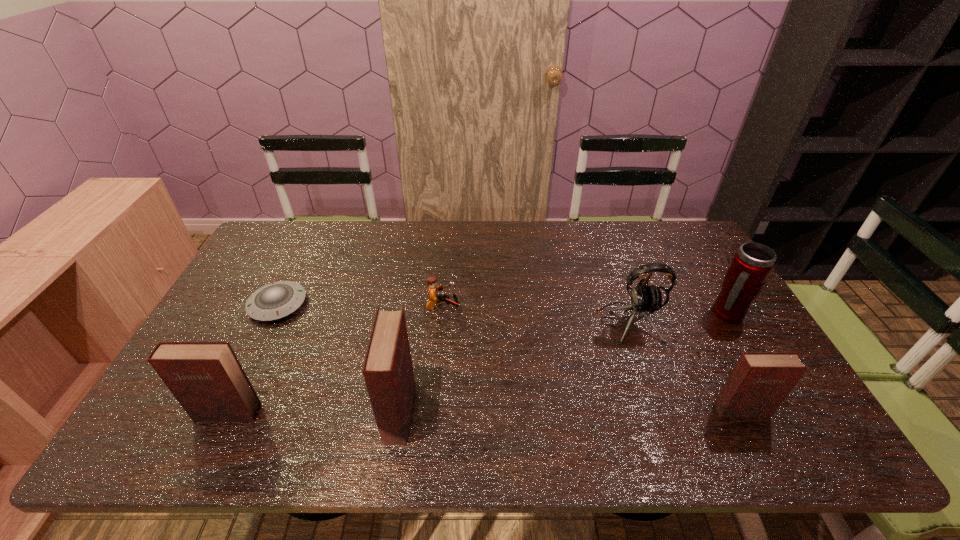
This screenshot has height=540, width=960. In order to click on the second shortest diary in this screenshot , I will do `click(206, 378)`.

You are a GUI agent. You are given a task and a screenshot of the screen. Output one action in this format:
    pyautogui.click(x=<x>, y=<y>)
    Task: Click on the second diary from right to left
    This screenshot has height=540, width=960.
    Given the screenshot: What is the action you would take?
    pos(388,371)

This screenshot has width=960, height=540. What are the coordinates of `the rightmost diary` in the screenshot? It's located at click(760, 381).

You are a GUI agent. You are given a task and a screenshot of the screen. Output one action in this format:
    pyautogui.click(x=<x>, y=<y>)
    Task: Click on the fifth tallest object
    
    Given the screenshot: What is the action you would take?
    pyautogui.click(x=760, y=381)

Where is `the fourth object from left to right`? The width and height of the screenshot is (960, 540). the fourth object from left to right is located at coordinates (434, 299).

I want to click on the sixth tallest object, so click(x=434, y=299).

This screenshot has height=540, width=960. Identify the location of earphone. (644, 299).

Find the location of `saucer`. saucer is located at coordinates (276, 300).

This screenshot has height=540, width=960. Find the location of `thermos bottle`. thermos bottle is located at coordinates (752, 264).

Locate an element on the screen. The width and height of the screenshot is (960, 540). vacant area situated 0.290m on the front cover of the fifth object from right to left is located at coordinates [x=534, y=412].